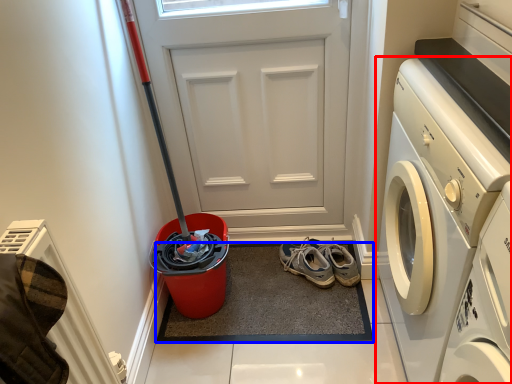
Question: Which object appears closest to the camera in this image, washing machine (highlighted by a red box) or doormat (highlighted by a blue box)?

Choices:
 (A) washing machine
 (B) doormat

Answer: (A)